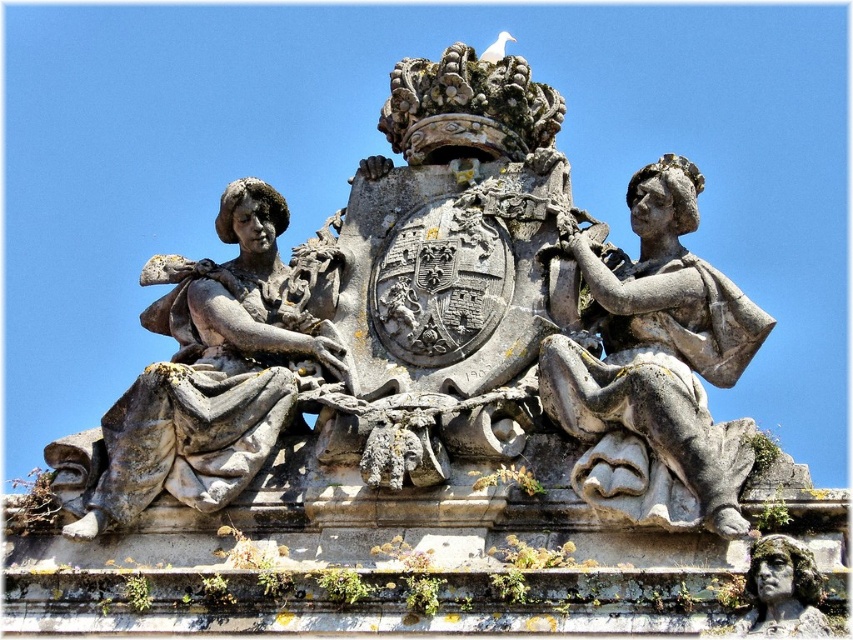
You are standing 10 meters away from the point at point (595, 422). If you walk directly towards the point, how far will you have to walk to reach it?

Since you are already at the point, you don not need to walk any further. The distance to the point is zero.